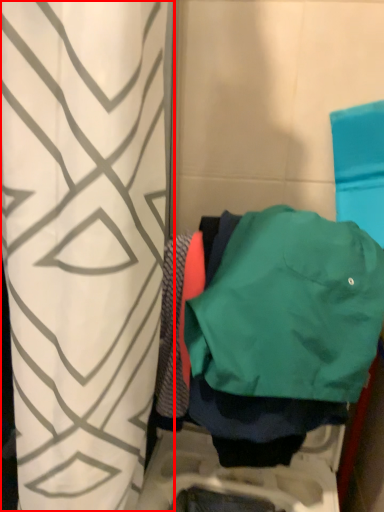
Question: From the image, what is the correct spatial relationship of curtain (annotated by the red box) in relation to jacket?

Choices:
 (A) right
 (B) left

Answer: (B)